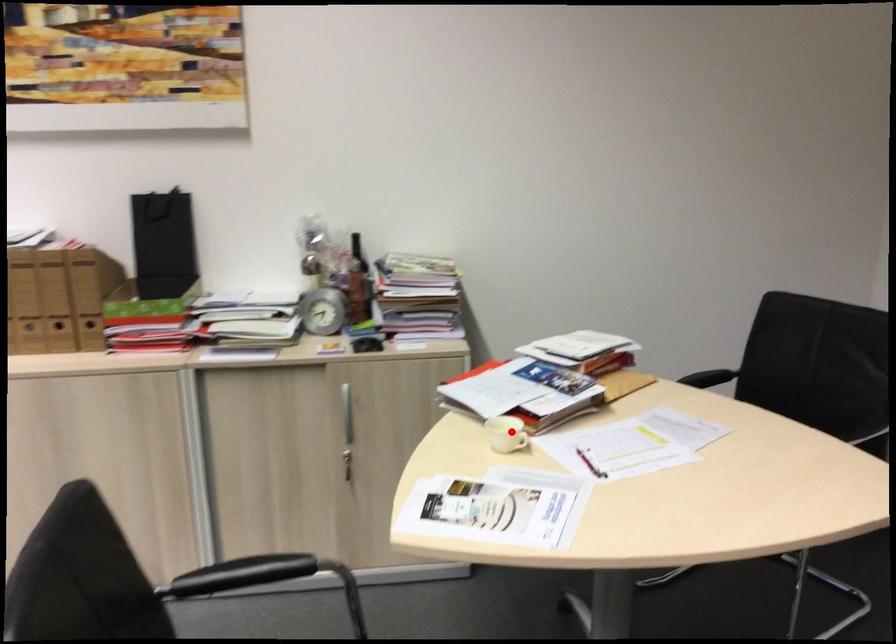
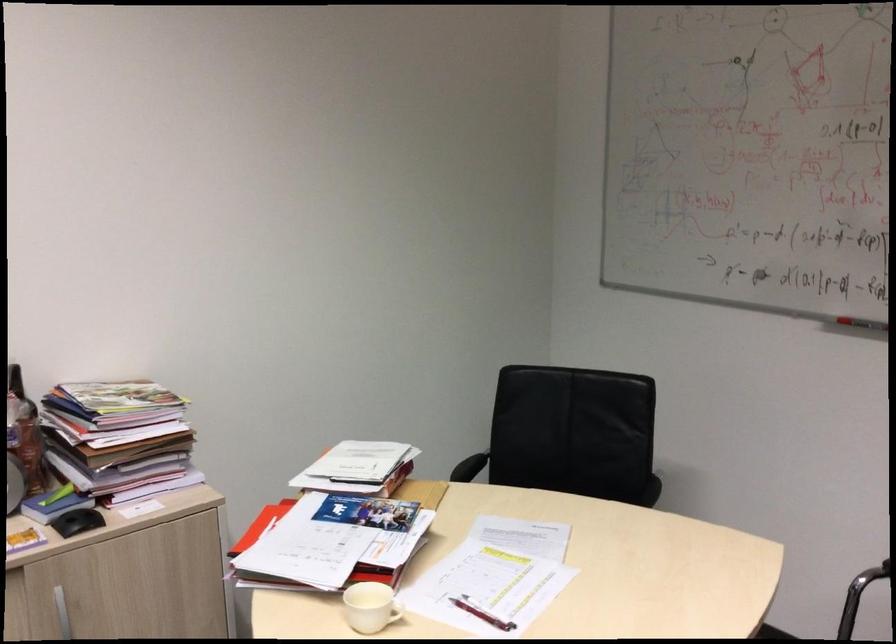
Question: I am providing you with two images of the same scene from different viewpoints. Image1 has a red point marked. In image2, the corresponding 3D location appears at what relative position? Reply with the corresponding letter.

Choices:
 (A) Closer
 (B) Farther

Answer: (A)